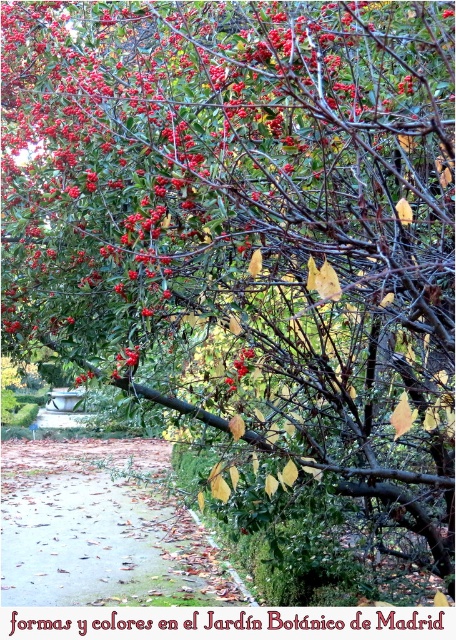
Who is more distant from viewer, (37, 481) or (248, 365)?

The point (37, 481) is more distant.

Which is more to the left, brown leafy path at lower left or smooth red berries at center?

brown leafy path at lower left is more to the left.

Which is behind, point (83, 448) or point (238, 380)?

Point (83, 448)

Identify the location of brown leafy path at lower left. (102, 529).